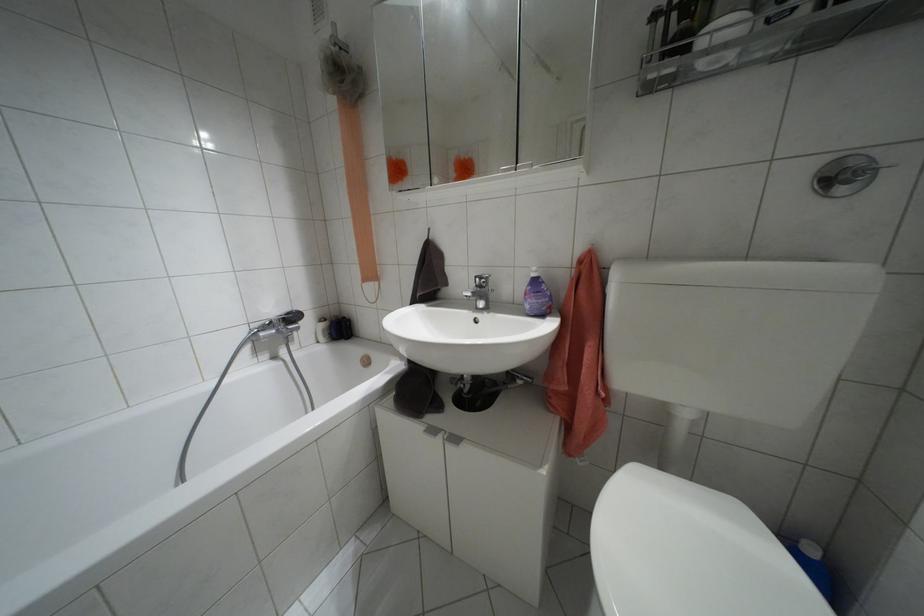
The image size is (924, 616). Find the location of `white toilet lid`. white toilet lid is located at coordinates (688, 553).